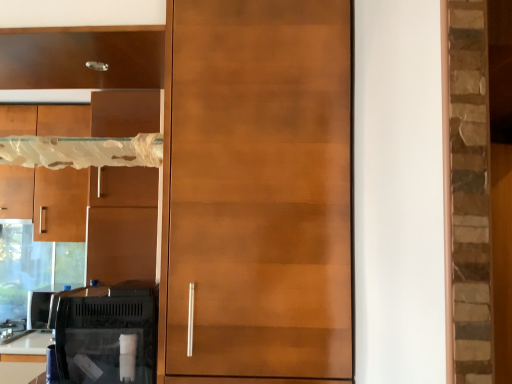
What are the coordinates of `vacant area situated below matte wood cabinet at upper left, the 2th cabinetry in the bottom-to-top sequence (from a real-world perspective)` in the screenshot? It's located at (83, 65).